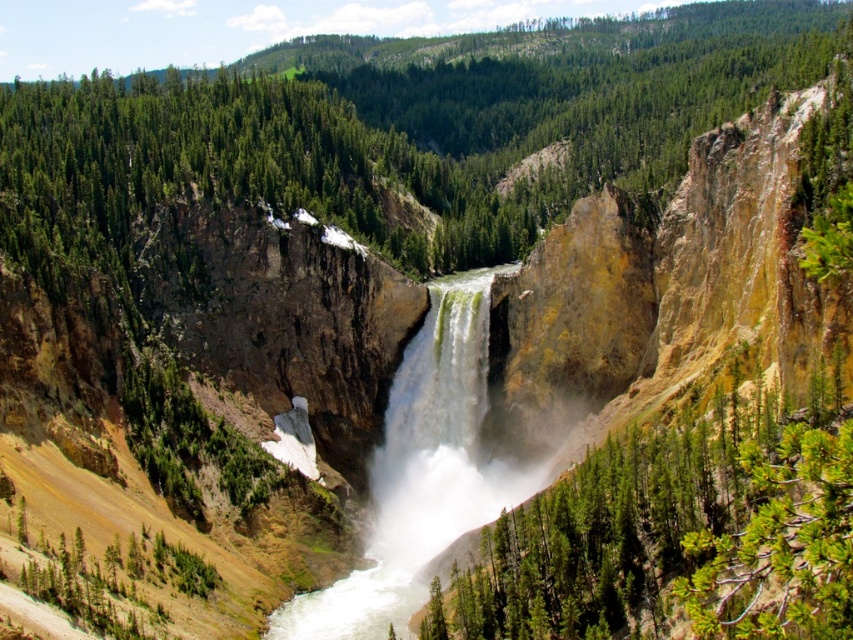
Can you confirm if green leafy tree at center is bigger than white frothy water at center?

Indeed, green leafy tree at center has a larger size compared to white frothy water at center.

Who is positioned more to the right, green leafy tree at center or white frothy water at center?

From the viewer's perspective, green leafy tree at center appears more on the right side.

Between point (699, 557) and point (375, 476), which one is positioned behind?

The point (375, 476) is behind.

You are a GUI agent. You are given a task and a screenshot of the screen. Output one action in this format:
    pyautogui.click(x=<x>, y=<y>)
    Task: Click on the green leafy tree at center
    
    Given the screenshot: What is the action you would take?
    click(675, 532)